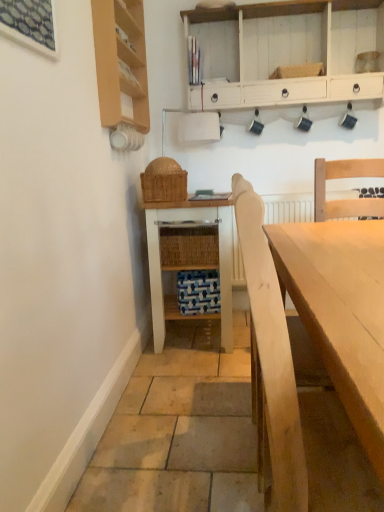
Question: Does wooden shelf at upper left have a greater height compared to white wood cabinet at upper center?

Choices:
 (A) yes
 (B) no

Answer: (A)

Question: Is white wood cabinet at upper center completely or partially inside wooden shelf at upper left?

Choices:
 (A) no
 (B) yes

Answer: (A)

Question: Are wooden shelf at upper left and white wood cabinet at upper center making contact?

Choices:
 (A) yes
 (B) no

Answer: (B)

Question: Is wooden shelf at upper left bigger than white wood cabinet at upper center?

Choices:
 (A) yes
 (B) no

Answer: (B)

Question: From the image's perspective, is wooden shelf at upper left over white wood cabinet at upper center?

Choices:
 (A) yes
 (B) no

Answer: (B)

Question: Visually, is white wood cabinet at upper center positioned to the left or to the right of white painted wood table at center?

Choices:
 (A) right
 (B) left

Answer: (A)

Question: Is white wood cabinet at upper center wider or thinner than white painted wood table at center?

Choices:
 (A) thin
 (B) wide

Answer: (A)

Question: Is white wood cabinet at upper center inside the boundaries of white painted wood table at center, or outside?

Choices:
 (A) outside
 (B) inside

Answer: (A)

Question: Considering the positions of point (340, 62) and point (168, 251), is point (340, 62) closer or farther from the camera than point (168, 251)?

Choices:
 (A) closer
 (B) farther

Answer: (B)

Question: Is light wood table at center wider or thinner than wooden shelf at upper left?

Choices:
 (A) wide
 (B) thin

Answer: (A)

Question: Considering the positions of point pos(362,445) and point pos(97,9), is point pos(362,445) closer or farther from the camera than point pos(97,9)?

Choices:
 (A) closer
 (B) farther

Answer: (A)

Question: Is light wood table at center in front of or behind wooden shelf at upper left in the image?

Choices:
 (A) behind
 (B) front

Answer: (B)

Question: Considering the relative positions of light wood table at center and wooden shelf at upper left in the image provided, is light wood table at center to the left or to the right of wooden shelf at upper left?

Choices:
 (A) right
 (B) left

Answer: (A)

Question: From the image's perspective, is wooden shelf at upper left positioned above or below white painted wood table at center?

Choices:
 (A) above
 (B) below

Answer: (A)

Question: In terms of width, does wooden shelf at upper left look wider or thinner when compared to white painted wood table at center?

Choices:
 (A) thin
 (B) wide

Answer: (A)